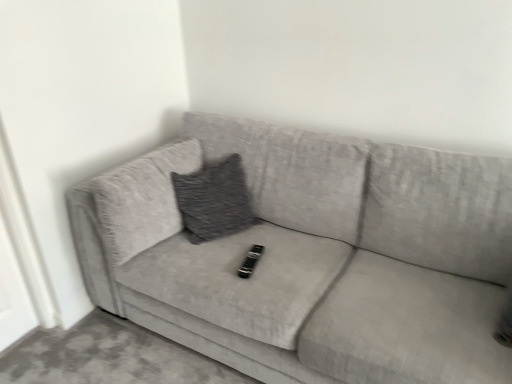
Question: Considering the positions of textured gray couch at center and black plastic remote at center in the image, is textured gray couch at center wider or thinner than black plastic remote at center?

Choices:
 (A) thin
 (B) wide

Answer: (B)

Question: Is textured gray couch at center in front of or behind black plastic remote at center in the image?

Choices:
 (A) front
 (B) behind

Answer: (A)

Question: From the image's perspective, is textured gray couch at center positioned above or below black plastic remote at center?

Choices:
 (A) above
 (B) below

Answer: (A)

Question: Considering the positions of black plastic remote at center and textured gray couch at center in the image, is black plastic remote at center wider or thinner than textured gray couch at center?

Choices:
 (A) wide
 (B) thin

Answer: (B)

Question: Is point (250, 261) closer or farther from the camera than point (207, 256)?

Choices:
 (A) closer
 (B) farther

Answer: (A)

Question: Based on their sizes in the image, would you say black plastic remote at center is bigger or smaller than textured gray couch at center?

Choices:
 (A) small
 (B) big

Answer: (A)

Question: Based on their positions, is black plastic remote at center located to the left or right of textured gray couch at center?

Choices:
 (A) left
 (B) right

Answer: (A)